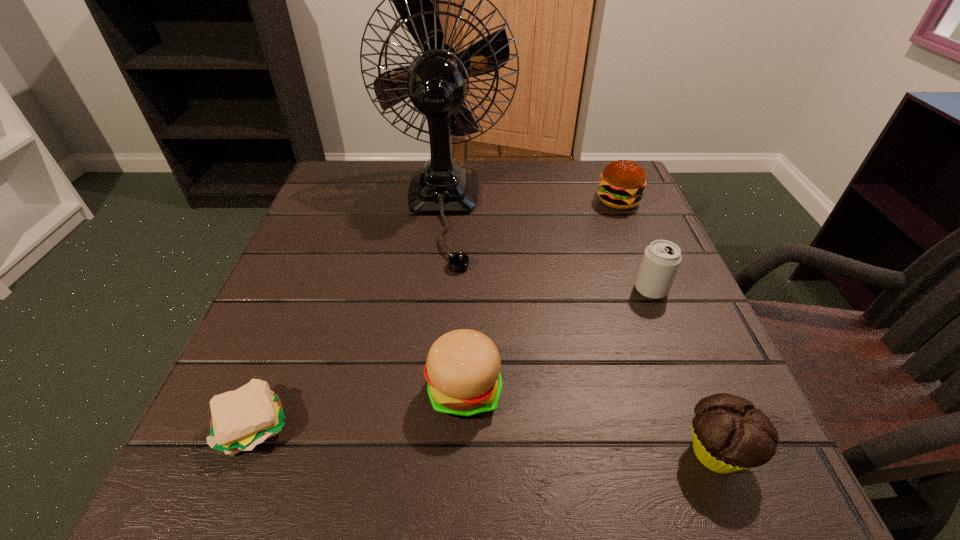
Where is `free space at the far left corner`? free space at the far left corner is located at coordinates (331, 205).

You are a GUI agent. You are given a task and a screenshot of the screen. Output one action in this format:
    pyautogui.click(x=<x>, y=<y>)
    Task: Click on the free space that is in between the fourth nearest object and the tallest object
    
    Given the screenshot: What is the action you would take?
    pyautogui.click(x=546, y=249)

The width and height of the screenshot is (960, 540). In order to click on unoccupied area between the muffin and the left hamburger in this screenshot , I will do `click(590, 422)`.

At what (x,y) coordinates should I click in order to perform the action: click on vacant area that lies between the fan and the muffin. Please return your answer as a coordinate pair (x, y). This screenshot has height=540, width=960. Looking at the image, I should click on tap(580, 330).

Where is `vacant area between the shortest object and the fan`? vacant area between the shortest object and the fan is located at coordinates (349, 316).

Where is `blank region between the right hamburger and the leftmost object`? blank region between the right hamburger and the leftmost object is located at coordinates (438, 313).

Where is `vacant area between the tallest object and the leftmost object`? vacant area between the tallest object and the leftmost object is located at coordinates (349, 316).

The width and height of the screenshot is (960, 540). What are the coordinates of `vacant space that is in between the right hamburger and the muffin` in the screenshot? It's located at (667, 327).

You are a GUI agent. You are given a task and a screenshot of the screen. Output one action in this format:
    pyautogui.click(x=<x>, y=<y>)
    Task: Click on the unoccupied position between the muffin and the farther hamburger
    
    Given the screenshot: What is the action you would take?
    pyautogui.click(x=667, y=327)

At what (x,y) coordinates should I click in order to perform the action: click on empty location between the farther hamburger and the muffin. Please return your answer as a coordinate pair (x, y). This screenshot has width=960, height=540. Looking at the image, I should click on (667, 327).